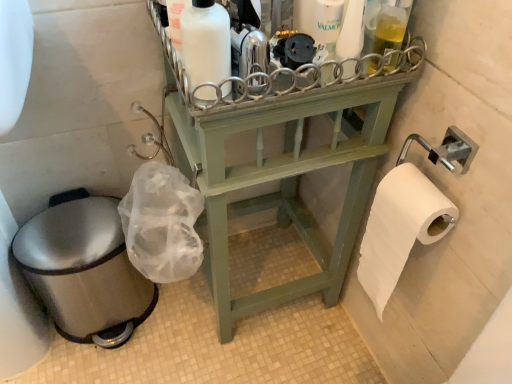
Question: Can you confirm if light green wood shelf at center is thinner than white matte bottle at upper center?

Choices:
 (A) yes
 (B) no

Answer: (B)

Question: Would you say white matte bottle at upper center is part of light green wood shelf at center's contents?

Choices:
 (A) no
 (B) yes

Answer: (A)

Question: From the image's perspective, is light green wood shelf at center over white matte bottle at upper center?

Choices:
 (A) no
 (B) yes

Answer: (A)

Question: From a real-world perspective, is light green wood shelf at center on white matte bottle at upper center?

Choices:
 (A) no
 (B) yes

Answer: (A)

Question: Can you confirm if light green wood shelf at center is wider than white matte bottle at upper center?

Choices:
 (A) no
 (B) yes

Answer: (B)

Question: Is light green wood shelf at center oriented towards white matte bottle at upper center?

Choices:
 (A) yes
 (B) no

Answer: (B)

Question: Can you confirm if white plastic bottle at upper center is taller than white matte bottle at upper center?

Choices:
 (A) yes
 (B) no

Answer: (A)

Question: Is white plastic bottle at upper center bigger than white matte bottle at upper center?

Choices:
 (A) no
 (B) yes

Answer: (B)

Question: From a real-world perspective, does white plastic bottle at upper center sit lower than white matte bottle at upper center?

Choices:
 (A) yes
 (B) no

Answer: (B)

Question: Is white plastic bottle at upper center located outside white matte bottle at upper center?

Choices:
 (A) yes
 (B) no

Answer: (A)

Question: From the image's perspective, is white plastic bottle at upper center located above white matte bottle at upper center?

Choices:
 (A) yes
 (B) no

Answer: (A)

Question: Could you tell me if white plastic bottle at upper center is turned towards white matte bottle at upper center?

Choices:
 (A) yes
 (B) no

Answer: (B)

Question: Considering the relative sizes of light green wood shelf at center and white plastic bottle at upper center in the image provided, is light green wood shelf at center taller than white plastic bottle at upper center?

Choices:
 (A) yes
 (B) no

Answer: (A)